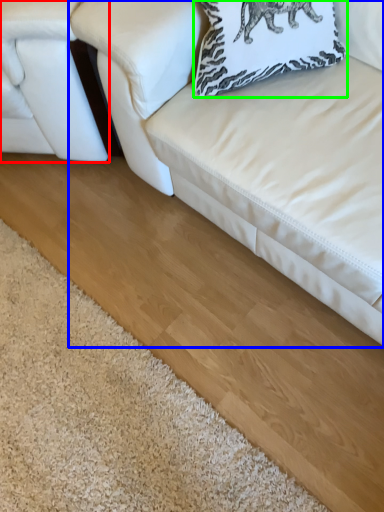
Question: Based on their relative distances, which object is nearer to studio couch (highlighted by a red box)? Choose from studio couch (highlighted by a blue box) and pillow (highlighted by a green box).

Choices:
 (A) studio couch
 (B) pillow

Answer: (A)